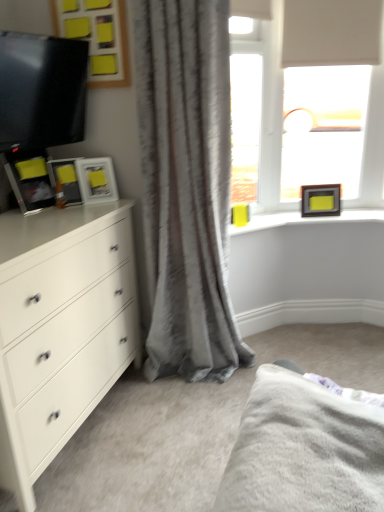
This screenshot has width=384, height=512. In order to click on free space in front of matte black picture frame at left, which appears as the 2th picture frame when viewed from the back in this screenshot , I will do `click(87, 208)`.